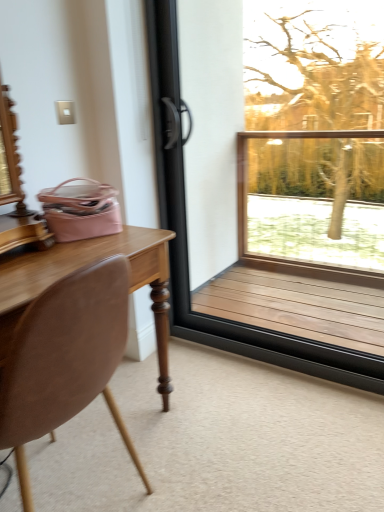
Question: In terms of size, does brown wooden window at right appear bigger or smaller than brown leather chair at left?

Choices:
 (A) big
 (B) small

Answer: (B)

Question: Is brown wooden window at right to the left or to the right of brown leather chair at left in the image?

Choices:
 (A) left
 (B) right

Answer: (B)

Question: Considering their positions, is brown wooden window at right located in front of or behind brown leather chair at left?

Choices:
 (A) front
 (B) behind

Answer: (B)

Question: In terms of height, does brown leather chair at left look taller or shorter compared to brown wooden window at right?

Choices:
 (A) tall
 (B) short

Answer: (B)

Question: From the image's perspective, is brown leather chair at left positioned above or below brown wooden window at right?

Choices:
 (A) above
 (B) below

Answer: (B)

Question: Looking at the image, does brown leather chair at left seem bigger or smaller compared to brown wooden window at right?

Choices:
 (A) small
 (B) big

Answer: (B)

Question: Is brown leather chair at left to the left or to the right of brown wooden window at right in the image?

Choices:
 (A) right
 (B) left

Answer: (B)